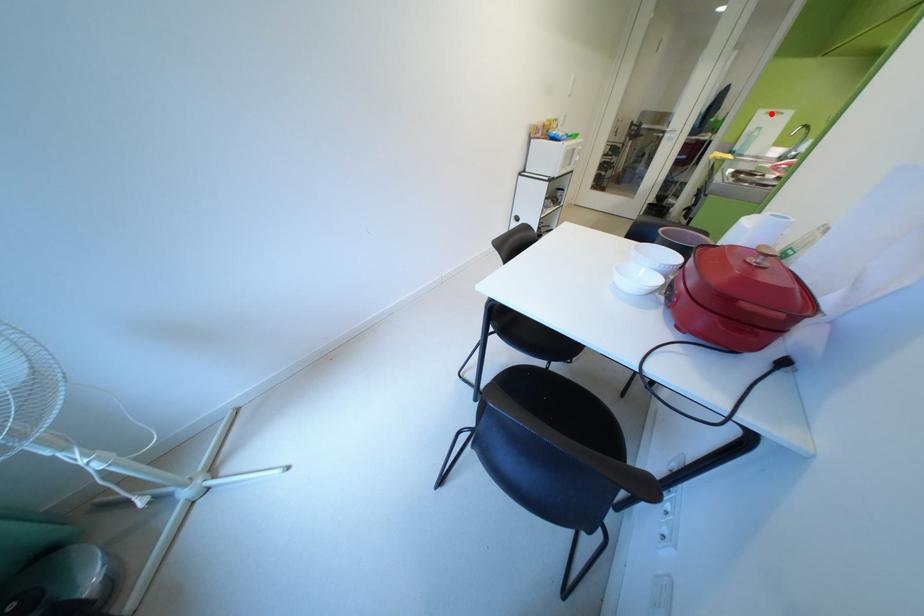
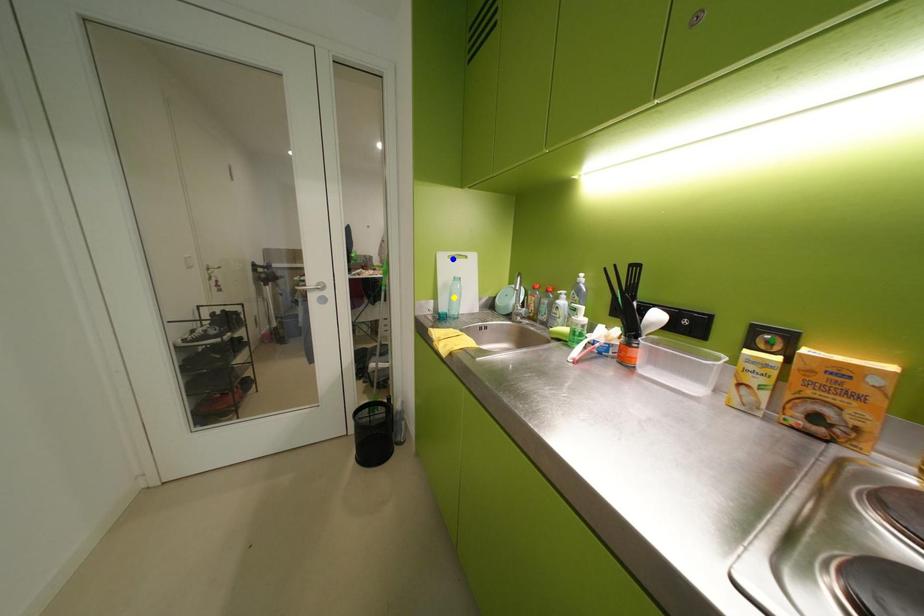
Question: I am providing you with two images of the same scene from different viewpoints. A red point is marked on the first image. You are given multiple points on the second image. Which spot in image 2 lines up with the point in image 1?

Choices:
 (A) blue point
 (B) green point
 (C) yellow point

Answer: (A)